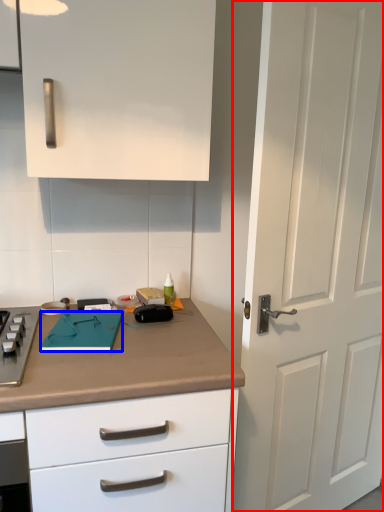
Question: Which object appears farthest to the camera in this image, door (highlighted by a red box) or notepad (highlighted by a blue box)?

Choices:
 (A) door
 (B) notepad

Answer: (B)